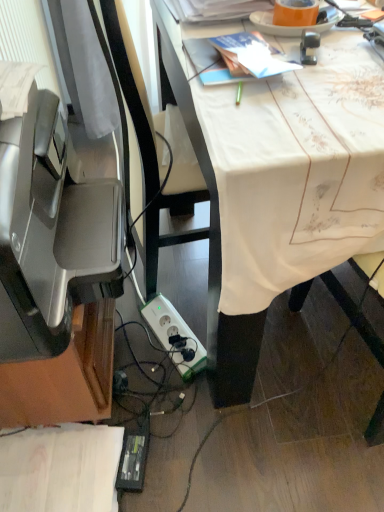
This screenshot has height=512, width=384. Find the location of `satin silver printer at left`. satin silver printer at left is located at coordinates (50, 234).

Describe the element at coordinates (273, 196) in the screenshot. The width and height of the screenshot is (384, 512). I see `white cloth-covered desk at center` at that location.

At what (x,y) coordinates should I click in order to perform the action: click on white plastic power plugs and sockets at lower center. Please return your answer as a coordinate pair (x, y). The height and width of the screenshot is (512, 384). Looking at the image, I should click on coord(175,336).

From a real-world perspective, is white plastic power plugs and sockets at lower center under white cloth-covered desk at center?

Yes.

Are white plastic power plugs and sockets at lower center and white cloth-covered desk at center far apart?

white plastic power plugs and sockets at lower center is actually quite close to white cloth-covered desk at center.

Between point (177, 369) and point (158, 3), which one is positioned in front?

The point (158, 3) is closer to the camera.

Relative to white cloth-covered desk at center, is white plastic power plugs and sockets at lower center in front or behind?

white plastic power plugs and sockets at lower center is positioned farther from the viewer than white cloth-covered desk at center.

Considering the sizes of satin silver printer at left and white cloth-covered desk at center in the image, is satin silver printer at left taller or shorter than white cloth-covered desk at center?

In the image, satin silver printer at left appears to be shorter than white cloth-covered desk at center.

Is satin silver printer at left directly adjacent to white cloth-covered desk at center?

No, satin silver printer at left is not in contact with white cloth-covered desk at center.

From a real-world perspective, does satin silver printer at left sit lower than white cloth-covered desk at center?

No, from a real-world perspective, satin silver printer at left is not below white cloth-covered desk at center.

Considering the points (116, 207) and (362, 137), which point is in front, point (116, 207) or point (362, 137)?

Positioned in front is point (362, 137).

From a real-world perspective, between white cloth-covered desk at center and white plastic power plugs and sockets at lower center, who is vertically higher?

white cloth-covered desk at center is physically above.

Does white cloth-covered desk at center contain white plastic power plugs and sockets at lower center?

Actually, white plastic power plugs and sockets at lower center is outside white cloth-covered desk at center.

Is white cloth-covered desk at center behind white plastic power plugs and sockets at lower center?

No, it is not.

How different are the orientations of white cloth-covered desk at center and white plastic power plugs and sockets at lower center in degrees?

white cloth-covered desk at center and white plastic power plugs and sockets at lower center are facing 21.6 degrees away from each other.

I want to click on printer above the white plastic power plugs and sockets at lower center (from the image's perspective), so click(50, 234).

How different are the orientations of satin silver printer at left and white plastic power plugs and sockets at lower center in degrees?

There is a 65.2-degree angle between the facing directions of satin silver printer at left and white plastic power plugs and sockets at lower center.

From the image's perspective, which object appears higher, satin silver printer at left or white plastic power plugs and sockets at lower center?

satin silver printer at left.

Can we say white plastic power plugs and sockets at lower center lies outside satin silver printer at left?

Yes, white plastic power plugs and sockets at lower center is located beyond the bounds of satin silver printer at left.

From a real-world perspective, is white plastic power plugs and sockets at lower center above or below satin silver printer at left?

In terms of real-world spatial position, white plastic power plugs and sockets at lower center is below satin silver printer at left.

Is white plastic power plugs and sockets at lower center to the left or to the right of satin silver printer at left in the image?

From the image, it's evident that white plastic power plugs and sockets at lower center is to the right of satin silver printer at left.

Can you tell me how much white plastic power plugs and sockets at lower center and satin silver printer at left differ in facing direction?

65.2 degrees separate the facing orientations of white plastic power plugs and sockets at lower center and satin silver printer at left.

Is white cloth-covered desk at center in front of or behind satin silver printer at left in the image?

In the image, white cloth-covered desk at center appears behind satin silver printer at left.

Considering the relative sizes of white cloth-covered desk at center and satin silver printer at left in the image provided, is white cloth-covered desk at center smaller than satin silver printer at left?

No, white cloth-covered desk at center is not smaller than satin silver printer at left.

From a real-world perspective, relative to satin silver printer at left, is white cloth-covered desk at center vertically above or below?

From a real-world perspective, white cloth-covered desk at center is physically below satin silver printer at left.

Can we say white cloth-covered desk at center lies outside satin silver printer at left?

That's correct, white cloth-covered desk at center is outside of satin silver printer at left.

Where is `power plugs and sockets located on the left of white cloth-covered desk at center`? power plugs and sockets located on the left of white cloth-covered desk at center is located at coordinates (175, 336).

I want to click on desk that appears behind the satin silver printer at left, so click(273, 196).

Looking at the image, which one is located further to satin silver printer at left, white plastic power plugs and sockets at lower center or white cloth-covered desk at center?

white plastic power plugs and sockets at lower center is further to satin silver printer at left.

Estimate the real-world distances between objects in this image. Which object is closer to satin silver printer at left, white cloth-covered desk at center or white plastic power plugs and sockets at lower center?

Among the two, white cloth-covered desk at center is located nearer to satin silver printer at left.

Which object lies further to the anchor point white cloth-covered desk at center, white plastic power plugs and sockets at lower center or satin silver printer at left?

white plastic power plugs and sockets at lower center is further to white cloth-covered desk at center.

Estimate the real-world distances between objects in this image. Which object is further from white cloth-covered desk at center, satin silver printer at left or white plastic power plugs and sockets at lower center?

white plastic power plugs and sockets at lower center is further to white cloth-covered desk at center.

Based on their spatial positions, is satin silver printer at left or white cloth-covered desk at center closer to white plastic power plugs and sockets at lower center?

The object closer to white plastic power plugs and sockets at lower center is white cloth-covered desk at center.

From the image, which object appears to be nearer to white plastic power plugs and sockets at lower center, white cloth-covered desk at center or satin silver printer at left?

Based on the image, white cloth-covered desk at center appears to be nearer to white plastic power plugs and sockets at lower center.

In order to click on desk positioned between satin silver printer at left and white plastic power plugs and sockets at lower center from near to far in this screenshot , I will do `click(273, 196)`.